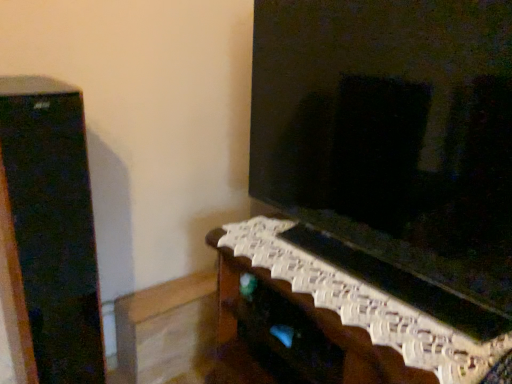
Describe the element at coordinates (368, 307) in the screenshot. The height and width of the screenshot is (384, 512). I see `white woven basket at lower right` at that location.

Locate an element on the screen. The height and width of the screenshot is (384, 512). white woven basket at lower right is located at coordinates (368, 307).

The image size is (512, 384). Identify the location of white woven basket at lower right. (368, 307).